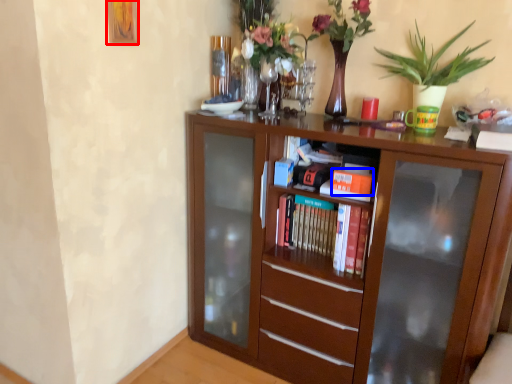
Question: Among these objects, which one is farthest to the camera, picture frame (highlighted by a red box) or book (highlighted by a blue box)?

Choices:
 (A) picture frame
 (B) book

Answer: (B)